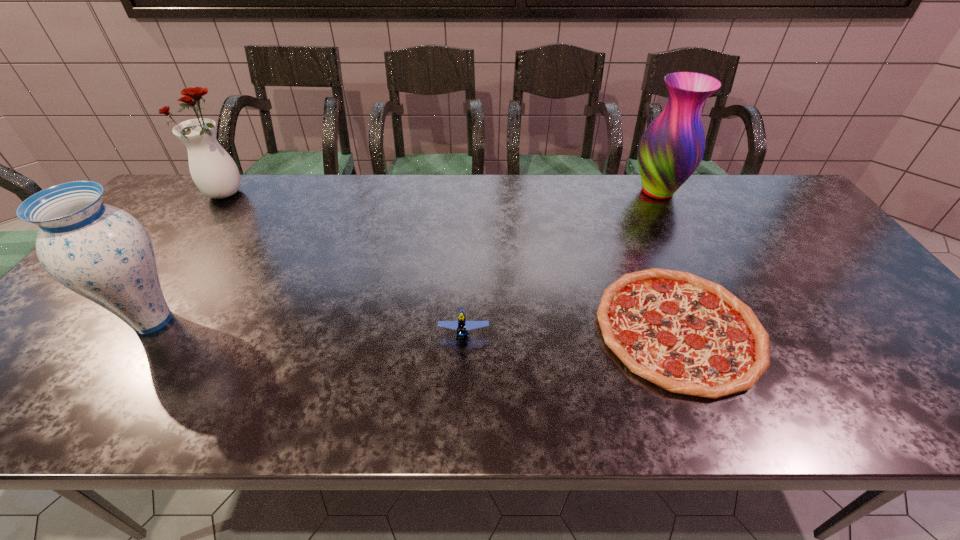
Identify the location of object situated at the far left corner. (213, 170).

Locate an element on the screen. The image size is (960, 540). vacant space at the far edge of the desktop is located at coordinates (606, 214).

Image resolution: width=960 pixels, height=540 pixels. In the image, there is a desktop. What are the coordinates of `vacant area at the near edge` in the screenshot? It's located at (568, 418).

Where is `vacant space at the left edge of the desktop`? vacant space at the left edge of the desktop is located at coordinates (33, 363).

Where is `blank space at the near right corner`? The height and width of the screenshot is (540, 960). blank space at the near right corner is located at coordinates (915, 401).

This screenshot has width=960, height=540. I want to click on free area in between the rightmost vase and the nearest vase, so click(405, 256).

The width and height of the screenshot is (960, 540). I want to click on free spot between the fourth tallest object and the nearest vase, so click(308, 327).

Identify the location of unoccupied position between the nearest vase and the shortest object. The width and height of the screenshot is (960, 540). (416, 325).

You are a GUI agent. You are given a task and a screenshot of the screen. Output one action in this format:
    pyautogui.click(x=<x>, y=<y>)
    Task: Click on the vacant space that is in between the third object from left to right and the pizza
    The width and height of the screenshot is (960, 540).
    Given the screenshot: What is the action you would take?
    pyautogui.click(x=571, y=331)

Find the location of a particular element. Image resolution: width=960 pixels, height=540 pixels. empty space that is in between the rightmost vase and the Lego is located at coordinates (561, 262).